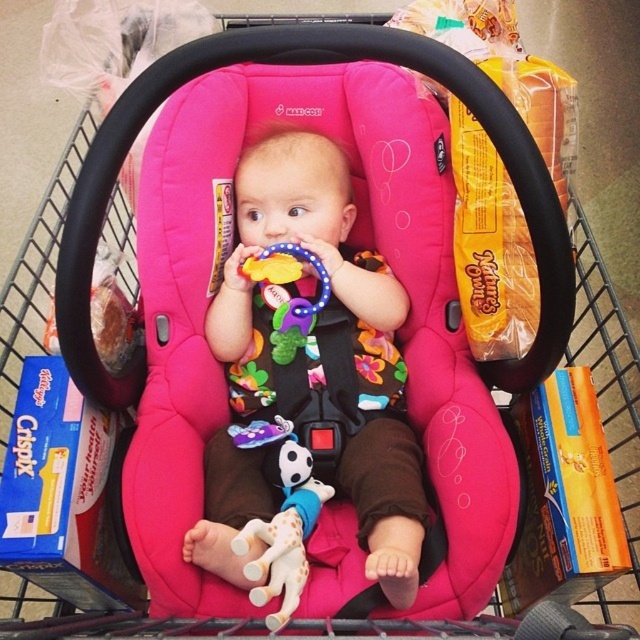
You are a parent holding a 12 inch long grocery bag that you want to place between the matte pink car seat at center and yourself. Is there enough space to fit the grocery bag there?

The matte pink car seat at center and viewer are 31.91 inches apart. Since the grocery bag is 12 inches long, there is sufficient space to place it between the matte pink car seat at center and yourself.